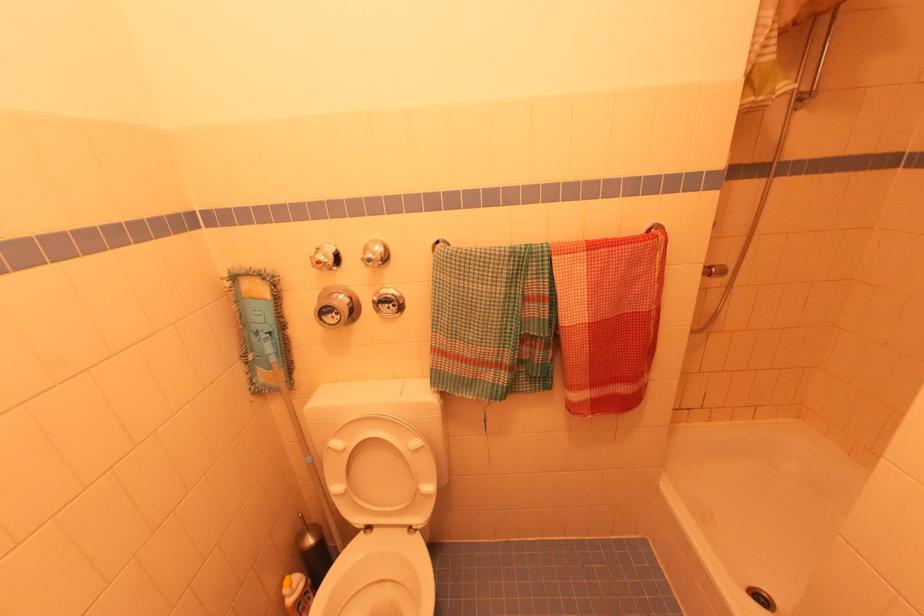
This screenshot has width=924, height=616. What do you see at coordinates (444, 249) in the screenshot?
I see `a metal towel bar` at bounding box center [444, 249].